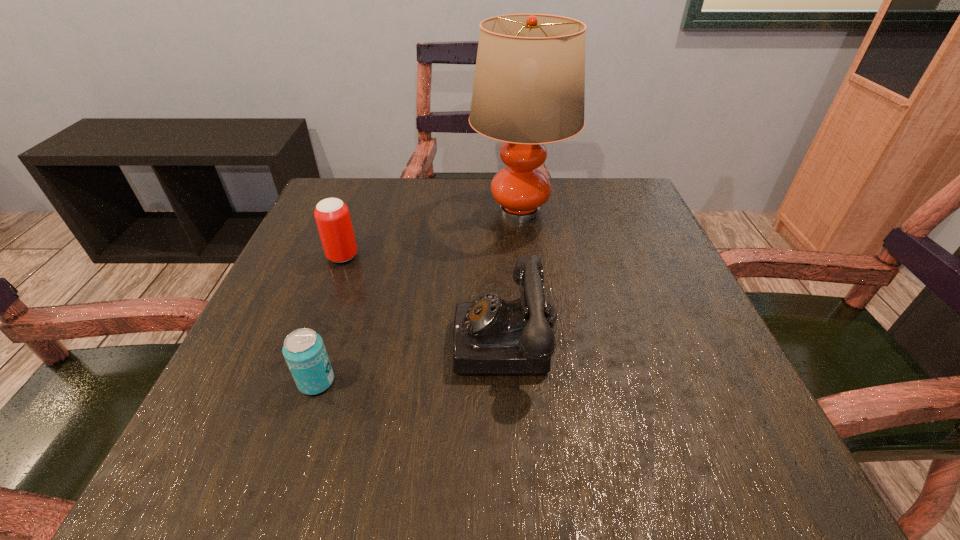
Where is `the third closest object to the farthest object`? This screenshot has width=960, height=540. the third closest object to the farthest object is located at coordinates (304, 351).

The image size is (960, 540). I want to click on vacant space that satisfies the following two spatial constraints: 1. on the dial of the telephone; 2. on the front side of the shortest object, so click(x=510, y=381).